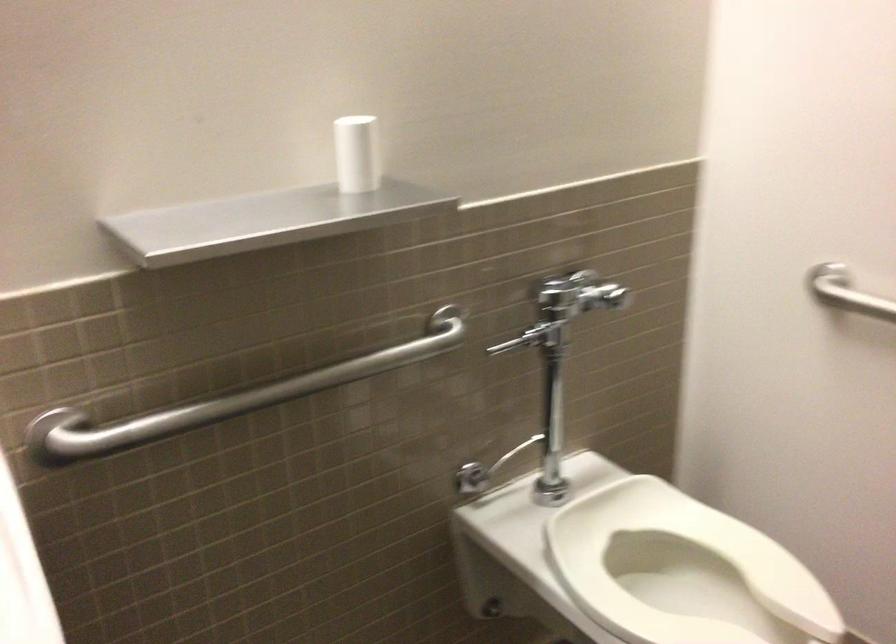
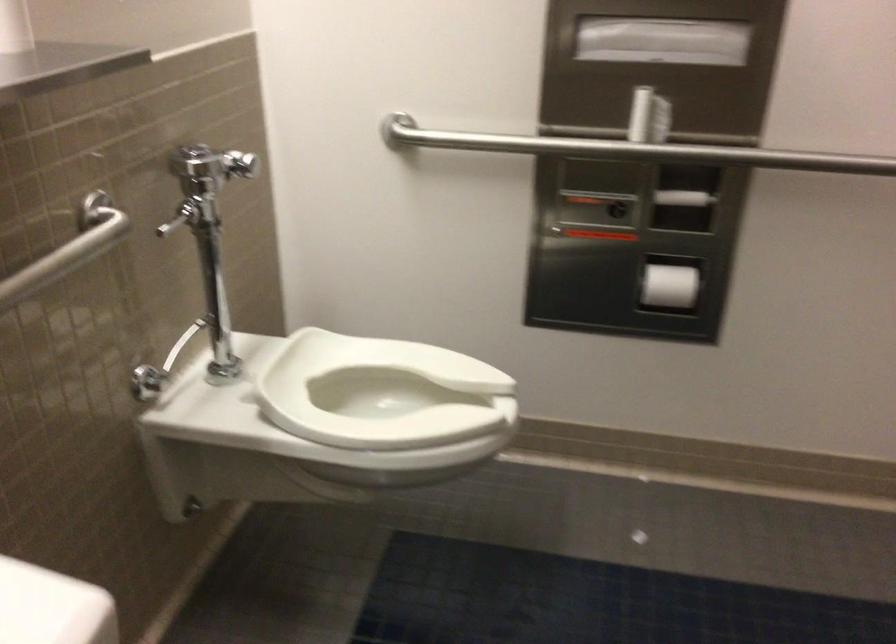
Locate, in the second image, the point that corresponds to (x=709, y=574) in the first image.

(381, 393)